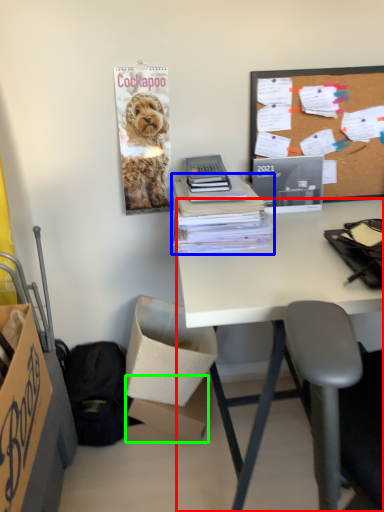
Question: Which object is the closest to the desk (highlighted by a red box)? Choose among these: office supplies (highlighted by a blue box) or box (highlighted by a green box).

Choices:
 (A) office supplies
 (B) box

Answer: (A)